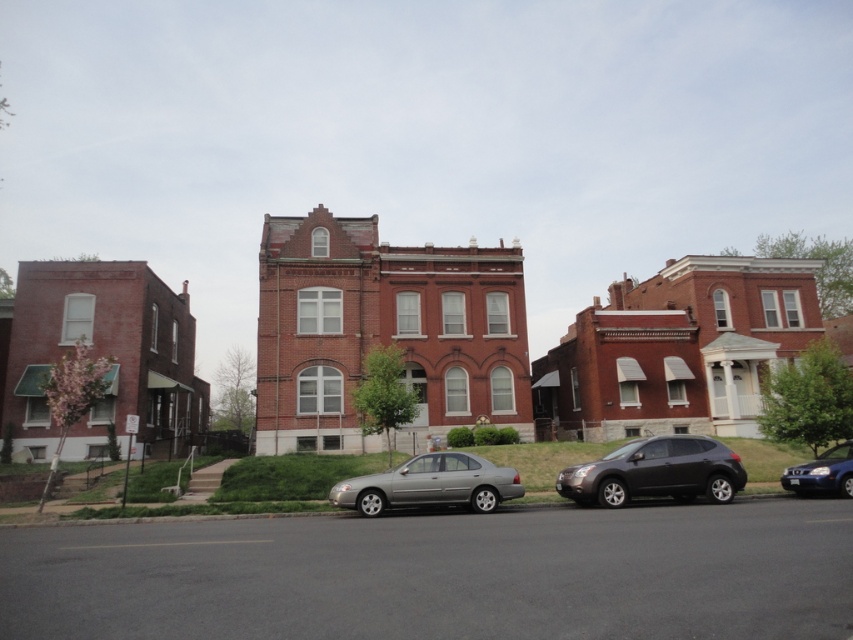
Does satin black suv at center appear on the right side of shiny blue sedan at lower right?

In fact, satin black suv at center is to the left of shiny blue sedan at lower right.

Which is below, satin black suv at center or shiny blue sedan at lower right?

satin black suv at center is below.

Does point (648, 492) lie behind point (824, 452)?

That is False.

Where is `satin black suv at center`? The image size is (853, 640). satin black suv at center is located at coordinates (656, 472).

Is satin silver sedan at center behind shiny blue sedan at lower right?

No, satin silver sedan at center is closer to the viewer.

Looking at this image, is satin silver sedan at center thinner than shiny blue sedan at lower right?

Correct, satin silver sedan at center's width is less than shiny blue sedan at lower right's.

Is point (506, 470) farther from viewer compared to point (817, 483)?

No, (506, 470) is in front of (817, 483).

The width and height of the screenshot is (853, 640). What are the coordinates of `satin silver sedan at center` in the screenshot? It's located at (430, 484).

Is satin black suv at center above satin silver sedan at center?

Actually, satin black suv at center is below satin silver sedan at center.

Does satin black suv at center have a greater width compared to satin silver sedan at center?

Yes, satin black suv at center is wider than satin silver sedan at center.

Is point (631, 492) closer to camera compared to point (453, 472)?

Yes, point (631, 492) is in front of point (453, 472).

Identify the location of satin black suv at center. (656, 472).